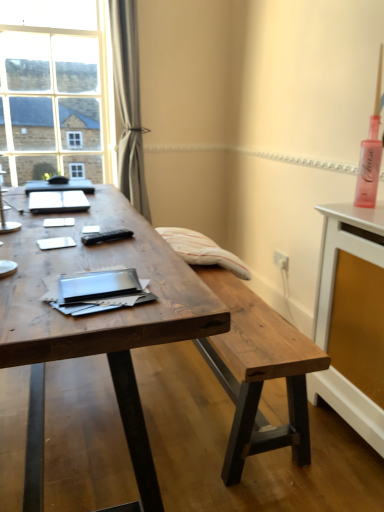
Where is `free space on the front side of matte black notebook at center`? This screenshot has width=384, height=512. free space on the front side of matte black notebook at center is located at coordinates (58, 219).